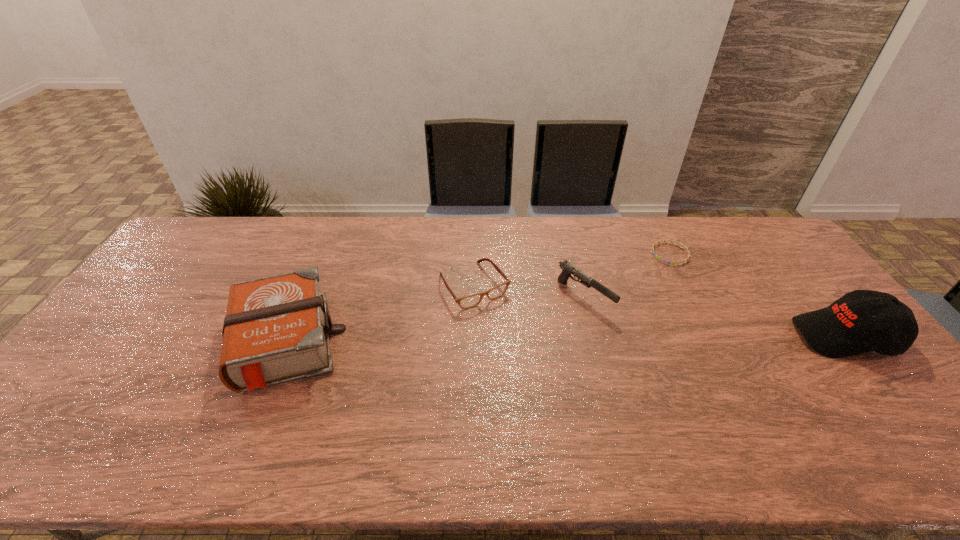
This screenshot has width=960, height=540. Find the location of `free space on the desktop that is between the Bible and the baseball cap and is positioned on the front-facing side of the spectacles`. free space on the desktop that is between the Bible and the baseball cap and is positioned on the front-facing side of the spectacles is located at coordinates (514, 340).

Locate an element on the screen. free space on the desktop that is between the leftmost object and the rightmost object and is positioned at the muzzle end of the gun is located at coordinates (642, 339).

Where is `free space on the desktop that is between the leftmost object and the rightmost object and is positioned on the surface of the fourth object from left to right showing star-shaped elements`? free space on the desktop that is between the leftmost object and the rightmost object and is positioned on the surface of the fourth object from left to right showing star-shaped elements is located at coordinates (558, 339).